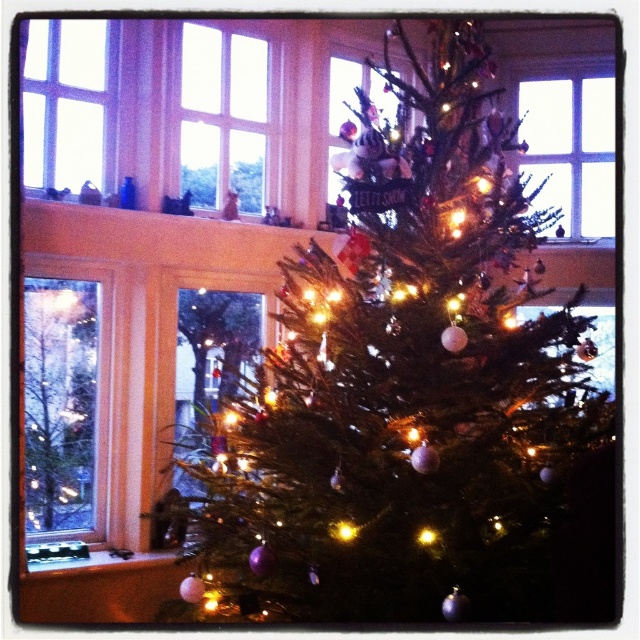
Can you confirm if clear glass window at upper left is positioned to the left of matte black stove at lower left?

Correct, you'll find clear glass window at upper left to the left of matte black stove at lower left.

Does clear glass window at upper left appear on the right side of matte black stove at lower left?

No, clear glass window at upper left is not to the right of matte black stove at lower left.

I want to click on clear glass window at upper left, so click(x=67, y=100).

Find the location of `clear glass window at upper left`. clear glass window at upper left is located at coordinates (67, 100).

Is transparent glass window at left to the left of transparent glass window at upper right from the viewer's perspective?

Indeed, transparent glass window at left is positioned on the left side of transparent glass window at upper right.

Can you confirm if transparent glass window at left is smaller than transparent glass window at upper right?

Yes, transparent glass window at left is smaller than transparent glass window at upper right.

Is point (60, 500) more distant than point (593, 154)?

No, (60, 500) is in front of (593, 154).

Locate an element on the screen. transparent glass window at left is located at coordinates (60, 403).

Which of these two, transparent glass window at left or matte black stove at lower left, stands taller?

transparent glass window at left is taller.

Is transparent glass window at left further to camera compared to matte black stove at lower left?

Yes, transparent glass window at left is further from the viewer.

Does point (36, 490) lie behind point (179, 556)?

Yes, it is.

Find the location of a particular element. transparent glass window at left is located at coordinates (60, 403).